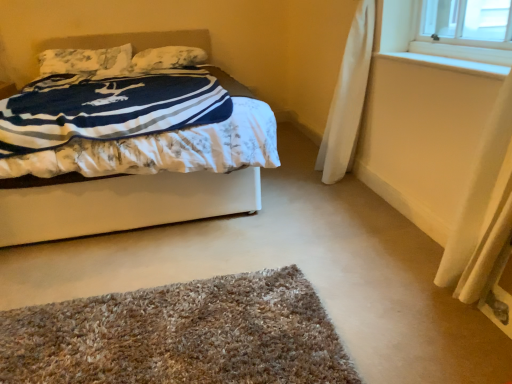
This screenshot has width=512, height=384. In order to click on vacant space in brown shaggy rug at lower center (from a real-world perspective) in this screenshot , I will do `click(176, 346)`.